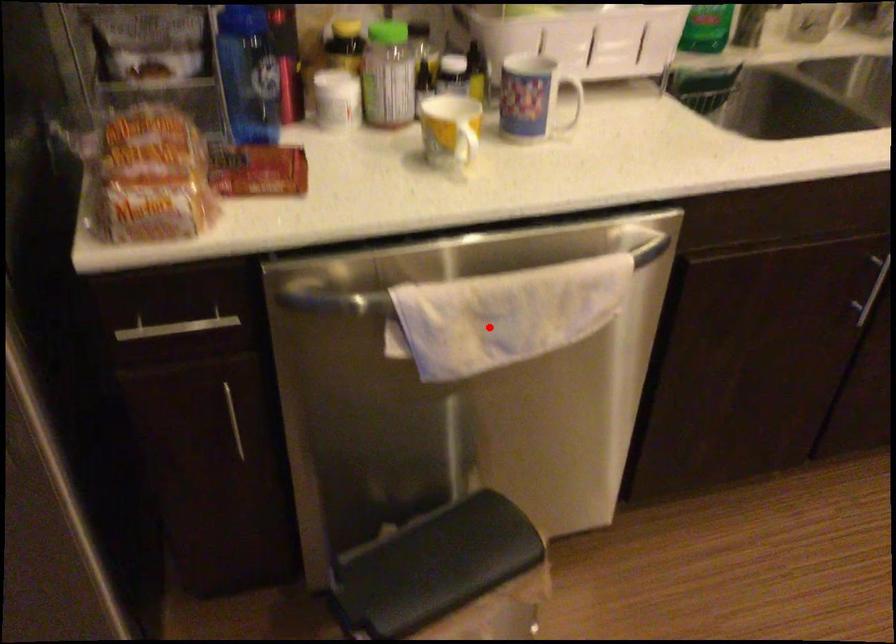
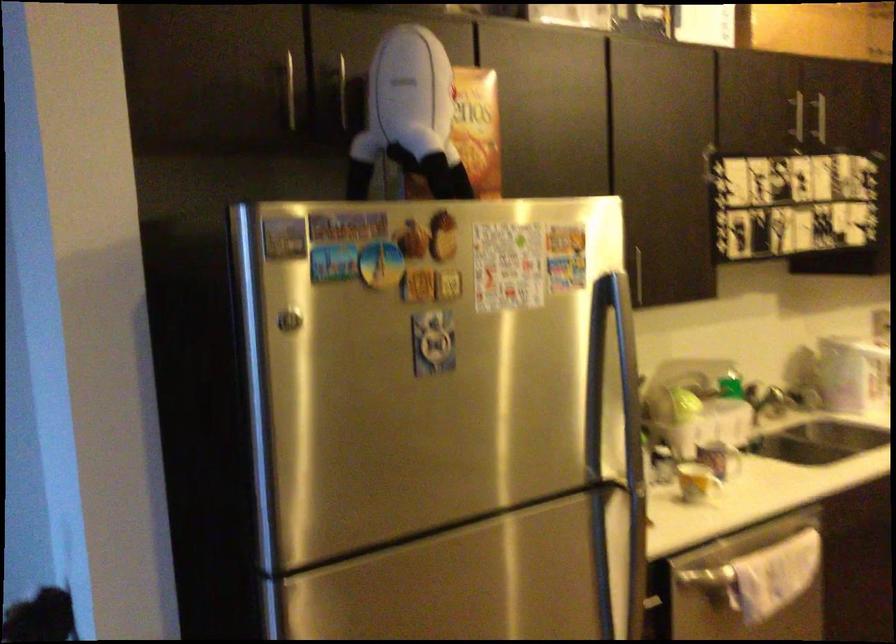
Question: I am providing you with two images of the same scene from different viewpoints. Image1 has a red point marked. In image2, the corresponding 3D location appears at what relative position? Reply with the corresponding letter.

Choices:
 (A) Closer
 (B) Farther

Answer: (B)